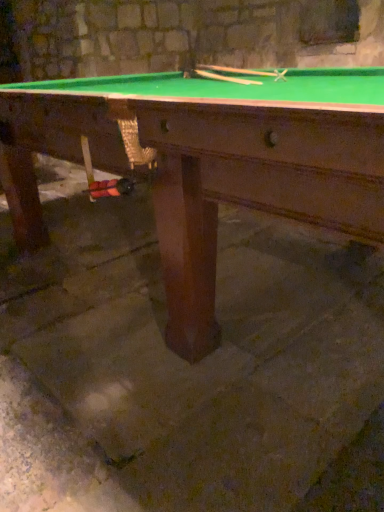
Question: From a real-world perspective, is wooden smooth cue at upper center, positioned as the 2th cue in left-to-right order, under brown stone concrete at center?

Choices:
 (A) yes
 (B) no

Answer: (B)

Question: From the image's perspective, is wooden smooth cue at upper center, positioned as the 2th cue in left-to-right order, below brown stone concrete at center?

Choices:
 (A) yes
 (B) no

Answer: (B)

Question: Can you confirm if wooden smooth cue at upper center, positioned as the 2th cue in left-to-right order, is positioned to the right of brown stone concrete at center?

Choices:
 (A) yes
 (B) no

Answer: (A)

Question: Is brown stone concrete at center at the back of wooden smooth cue at upper center, positioned as the 2th cue in left-to-right order?

Choices:
 (A) yes
 (B) no

Answer: (A)

Question: Can you confirm if wooden smooth cue at upper center, arranged as the 1th cue when viewed from the right, is positioned to the left of brown stone concrete at center?

Choices:
 (A) yes
 (B) no

Answer: (B)

Question: Is point (284, 442) positioned closer to the camera than point (198, 64)?

Choices:
 (A) closer
 (B) farther

Answer: (A)

Question: From the image's perspective, is brown stone concrete at center above or below wooden smooth cue at upper center, arranged as the 1th cue when viewed from the right?

Choices:
 (A) above
 (B) below

Answer: (B)

Question: Is brown stone concrete at center in front of or behind wooden smooth cue at upper center, arranged as the 1th cue when viewed from the right, in the image?

Choices:
 (A) behind
 (B) front

Answer: (B)

Question: Looking at their shapes, would you say brown stone concrete at center is wider or thinner than wooden smooth cue at upper center, arranged as the 1th cue when viewed from the right?

Choices:
 (A) thin
 (B) wide

Answer: (B)

Question: From their relative heights in the image, would you say brown stone concrete at center is taller or shorter than wooden smooth cue at upper center, acting as the first cue starting from the left?

Choices:
 (A) short
 (B) tall

Answer: (B)

Question: Is point (296, 244) closer or farther from the camera than point (221, 75)?

Choices:
 (A) farther
 (B) closer

Answer: (A)

Question: From a real-world perspective, relative to wooden smooth cue at upper center, acting as the first cue starting from the left, is brown stone concrete at center vertically above or below?

Choices:
 (A) above
 (B) below

Answer: (B)

Question: Considering the relative positions of brown stone concrete at center and wooden smooth cue at upper center, acting as the first cue starting from the left, in the image provided, is brown stone concrete at center to the left or to the right of wooden smooth cue at upper center, acting as the first cue starting from the left,?

Choices:
 (A) right
 (B) left

Answer: (A)

Question: Considering their positions, is wooden smooth cue at upper center, acting as the first cue starting from the left, located in front of or behind wooden smooth cue at upper center, arranged as the 1th cue when viewed from the right?

Choices:
 (A) behind
 (B) front

Answer: (B)

Question: Is point (211, 77) positioned closer to the camera than point (221, 72)?

Choices:
 (A) closer
 (B) farther

Answer: (A)